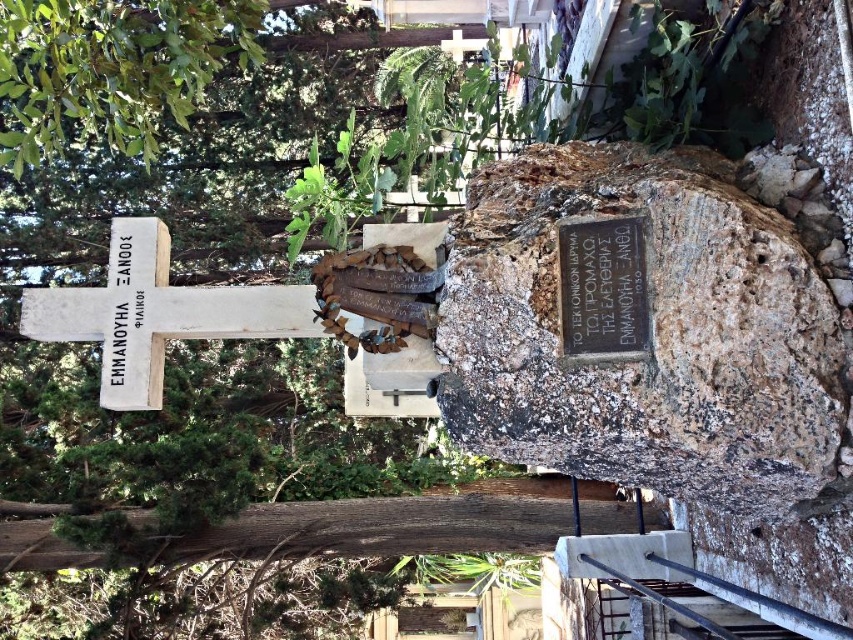
Question: From the image, what is the correct spatial relationship of rusty stone plaque at center in relation to white stone cross at upper left?

Choices:
 (A) right
 (B) left

Answer: (A)

Question: Among these objects, which one is nearest to the camera?

Choices:
 (A) white stone cross at upper left
 (B) rusty stone plaque at center
 (C) white stone cross at left

Answer: (B)

Question: Is white stone cross at left above white stone cross at upper left?

Choices:
 (A) no
 (B) yes

Answer: (A)

Question: Is rusty stone plaque at center above bronze plaque at center?

Choices:
 (A) no
 (B) yes

Answer: (A)

Question: Which point is closer to the camera?

Choices:
 (A) white stone cross at left
 (B) bronze plaque at center
 (C) white stone cross at upper left

Answer: (B)

Question: Which point is closer to the camera taking this photo?

Choices:
 (A) (624, 326)
 (B) (125, 301)
 (C) (85, 340)

Answer: (A)